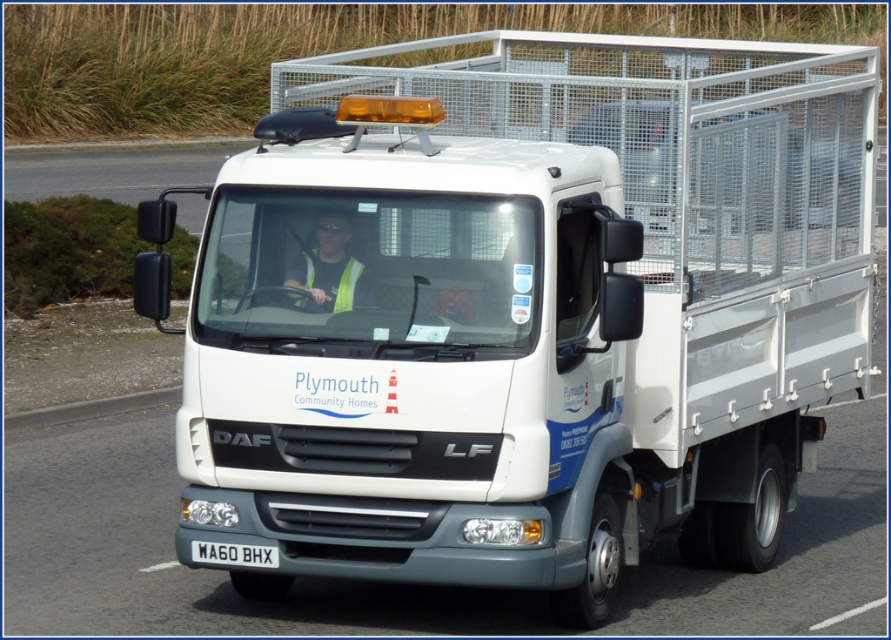
From the picture: You are a safety inspector checking the visibility of reflective vests on the truck. Both the yellow reflective vest at center and the yellow reflective safety vest at center are present. Which one is bigger in size?

The yellow reflective vest at center is larger in size than the yellow reflective safety vest at center.

In the scene shown: You are a pedestrian standing at the roadside and see the white plastic license plate at center and the yellow reflective safety vest at center. Which object is closer to you?

The white plastic license plate at center is closer to you because the yellow reflective safety vest at center is behind it.

What is the exact coordinate of the yellow reflective vest at center?

The yellow reflective vest at center is located at point (330, 269).